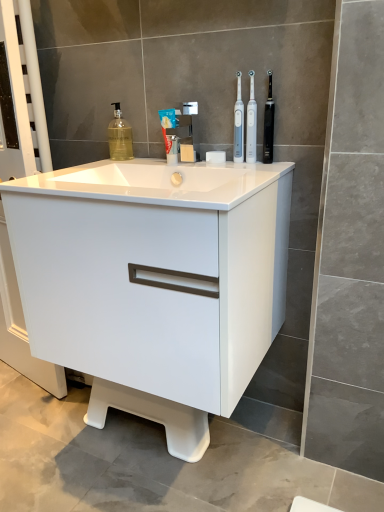
Question: Can you confirm if white plastic toothbrush at upper center, acting as the 2th toothbrush starting from the right, is thinner than chrome metallic faucet at upper center?

Choices:
 (A) yes
 (B) no

Answer: (A)

Question: From the image's perspective, is white plastic toothbrush at upper center, marked as the 2th toothbrush in a left-to-right arrangement, on chrome metallic faucet at upper center?

Choices:
 (A) no
 (B) yes

Answer: (B)

Question: Can we say white plastic toothbrush at upper center, acting as the 2th toothbrush starting from the right, lies outside chrome metallic faucet at upper center?

Choices:
 (A) no
 (B) yes

Answer: (B)

Question: Considering the relative positions of white plastic toothbrush at upper center, marked as the 2th toothbrush in a left-to-right arrangement, and chrome metallic faucet at upper center in the image provided, is white plastic toothbrush at upper center, marked as the 2th toothbrush in a left-to-right arrangement, to the right of chrome metallic faucet at upper center from the viewer's perspective?

Choices:
 (A) yes
 (B) no

Answer: (A)

Question: Is white plastic toothbrush at upper center, acting as the 2th toothbrush starting from the right, further to camera compared to chrome metallic faucet at upper center?

Choices:
 (A) yes
 (B) no

Answer: (A)

Question: Is white plastic toothbrush at upper center, acting as the 2th toothbrush starting from the right, shorter than chrome metallic faucet at upper center?

Choices:
 (A) yes
 (B) no

Answer: (B)

Question: Is white glossy cabinet at center at the back of white glossy sink at center?

Choices:
 (A) yes
 (B) no

Answer: (A)

Question: From the image's perspective, does white glossy sink at center appear lower than white glossy cabinet at center?

Choices:
 (A) no
 (B) yes

Answer: (A)

Question: Is white glossy sink at center thinner than white glossy cabinet at center?

Choices:
 (A) no
 (B) yes

Answer: (A)

Question: Is the depth of white glossy sink at center less than that of white glossy cabinet at center?

Choices:
 (A) yes
 (B) no

Answer: (A)

Question: Can you confirm if white glossy sink at center is wider than white glossy cabinet at center?

Choices:
 (A) no
 (B) yes

Answer: (B)

Question: Is white glossy sink at center behind white glossy cabinet at center?

Choices:
 (A) no
 (B) yes

Answer: (A)

Question: Does blue matte toothpaste at center come in front of white plastic toothbrush at upper center, acting as the 2th toothbrush starting from the right?

Choices:
 (A) no
 (B) yes

Answer: (A)